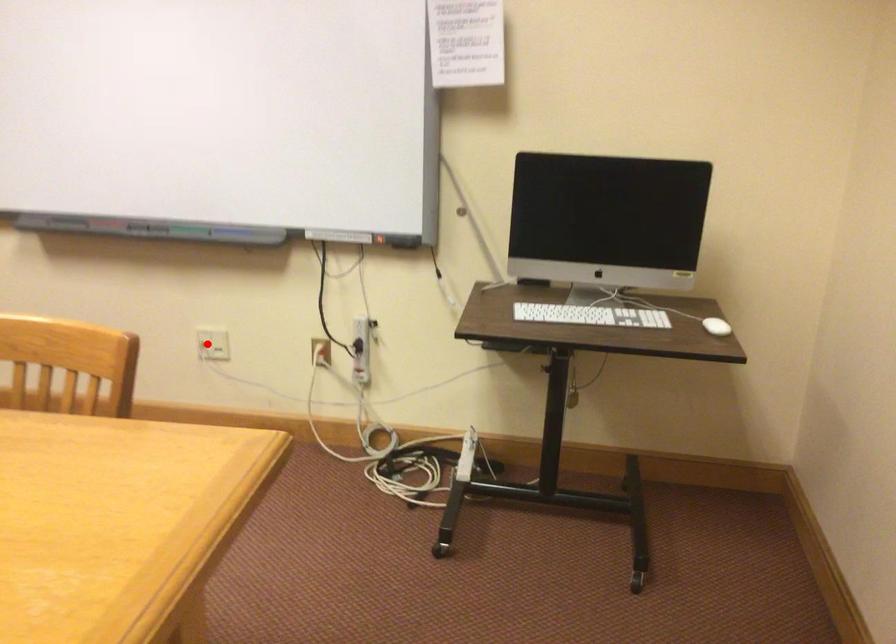
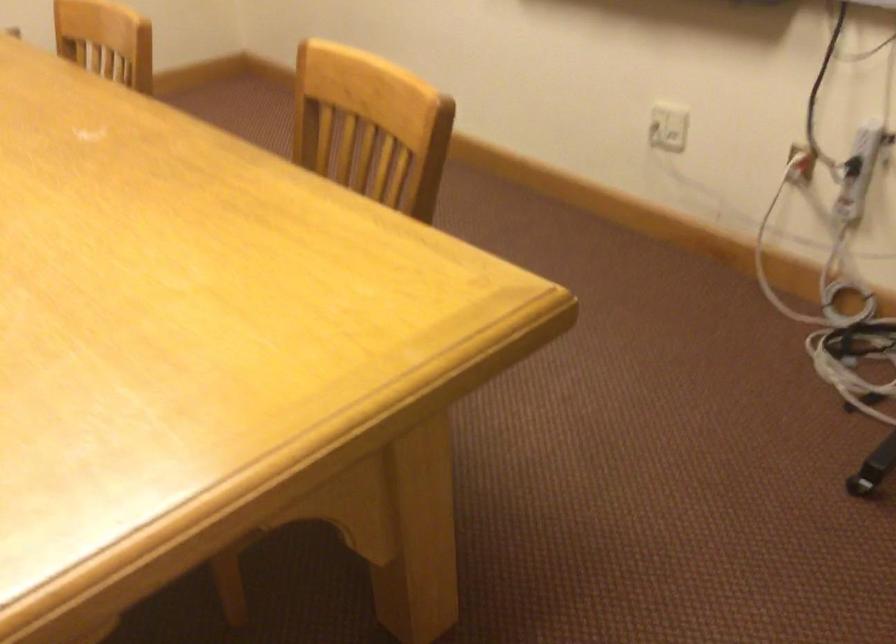
Question: I am providing you with two images of the same scene from different viewpoints. A red point is marked on the first image. Is the red point's position out of view in image 2?

Choices:
 (A) Yes
 (B) No

Answer: (B)